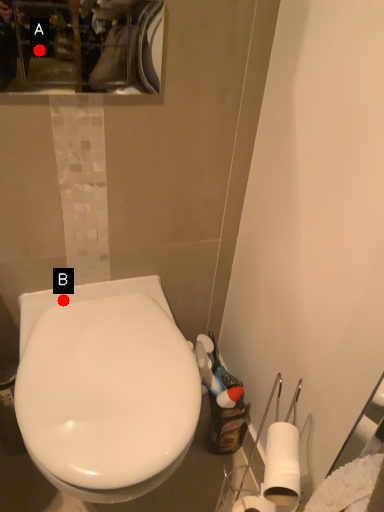
Question: Two points are circled on the image, labeled by A and B beside each circle. Which point appears closest to the camera in this image?

Choices:
 (A) A is closer
 (B) B is closer

Answer: (B)